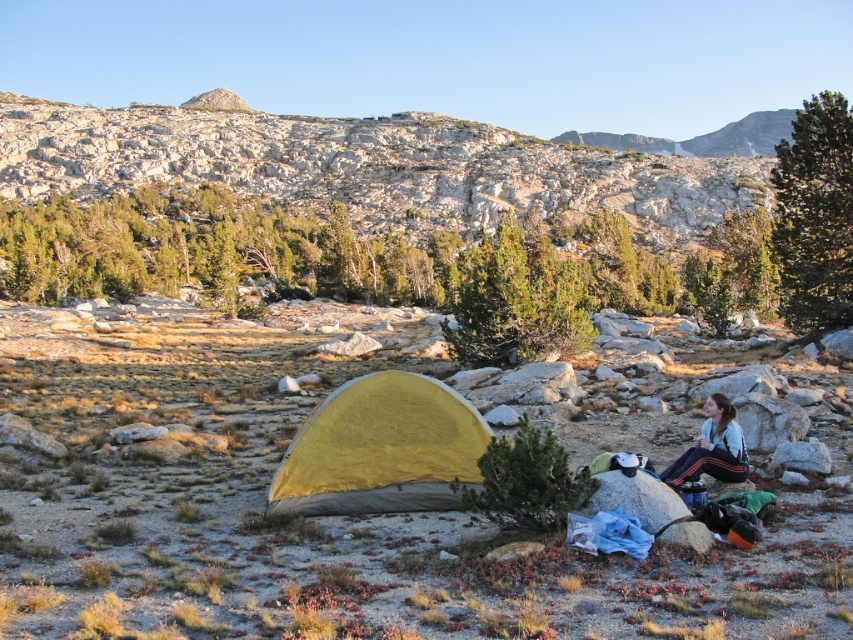
You are planning to set up a campsite and need to know the relative positions of the yellow fabric tent at lower center and the white fleece jacket at lower right. Which object is positioned to the left of the other?

The yellow fabric tent at lower center is to the left of the white fleece jacket at lower right.

Based on the photo, you are a hiker who just arrived at the campsite. You need to store your white fleece jacket at lower right. Where should you put it in relation to the yellow fabric tent at lower center?

The yellow fabric tent at lower center is larger than the white fleece jacket at lower right, so you can store the white fleece jacket at lower right inside the yellow fabric tent at lower center.

You are a hiker who wants to know where to place your new tent. Based on the scene, is the yellow fabric tent at lower center located above or below the white fleece jacket at lower right?

The yellow fabric tent at lower center is below the white fleece jacket at lower right.